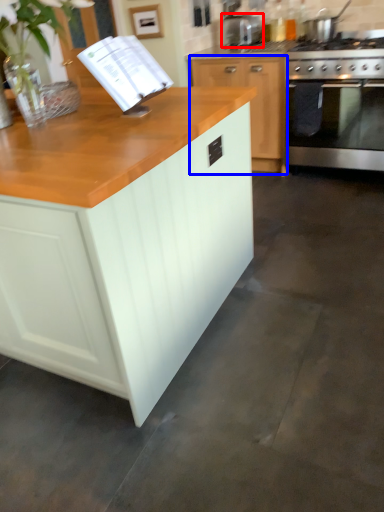
Question: Which of the following is the closest to the observer, appliance (highlighted by a red box) or cabinetry (highlighted by a blue box)?

Choices:
 (A) appliance
 (B) cabinetry

Answer: (B)